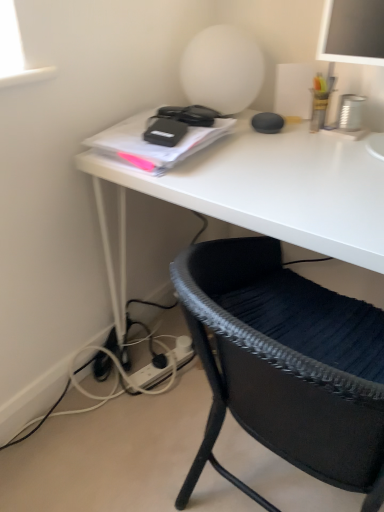
Question: From a real-world perspective, is white plastic plug at lower center above or below white matte desk at center?

Choices:
 (A) above
 (B) below

Answer: (B)

Question: From the image's perspective, is white plastic plug at lower center positioned above or below white matte desk at center?

Choices:
 (A) below
 (B) above

Answer: (A)

Question: Estimate the real-world distances between objects in this image. Which object is farther from the white plastic plug at lower center?

Choices:
 (A) black woven chair at lower right
 (B) white matte desk at center

Answer: (A)

Question: Estimate the real-world distances between objects in this image. Which object is closer to the black woven chair at lower right?

Choices:
 (A) white plastic plug at lower center
 (B) white matte desk at center

Answer: (B)